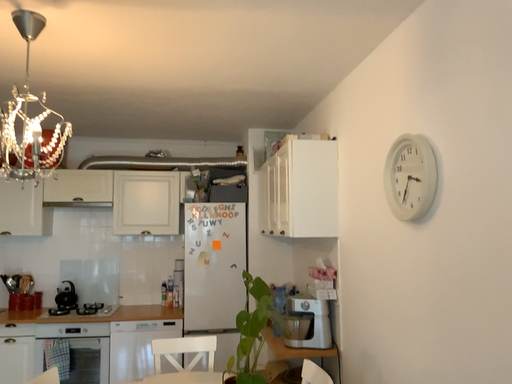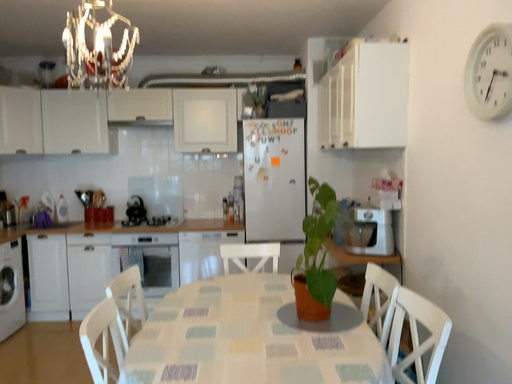
Question: How did the camera likely rotate when shooting the video?

Choices:
 (A) rotated right
 (B) rotated left

Answer: (B)